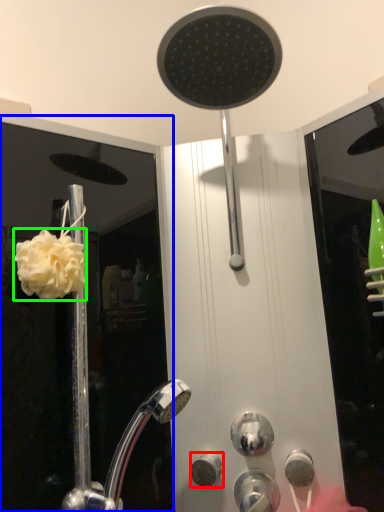
Question: Which object is the farthest from knob (highlighted by a red box)? Choose among these: screen door (highlighted by a blue box) or flower (highlighted by a green box).

Choices:
 (A) screen door
 (B) flower

Answer: (A)